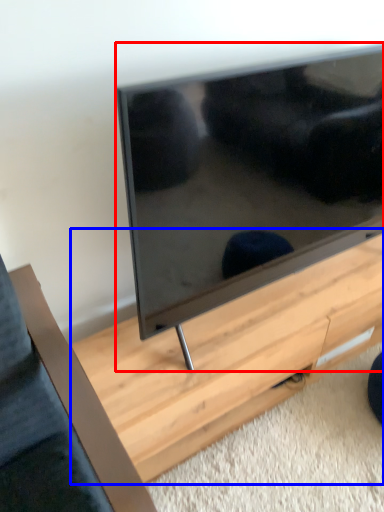
Question: Which object is further to the camera taking this photo, television (highlighted by a red box) or table (highlighted by a blue box)?

Choices:
 (A) television
 (B) table

Answer: (B)